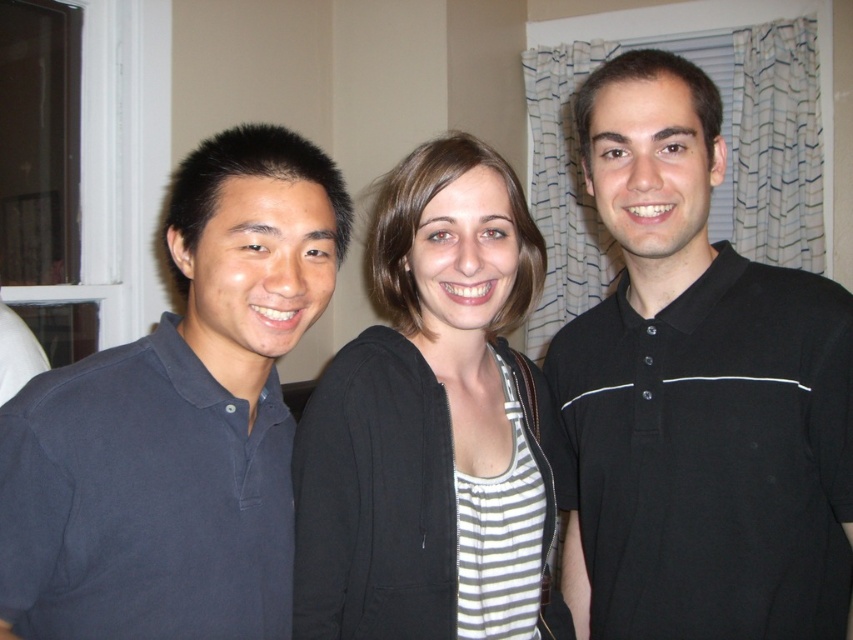
Question: Does black matte shirt at center appear over black zip-up hoodie at center?

Choices:
 (A) yes
 (B) no

Answer: (A)

Question: Which point appears closest to the camera in this image?

Choices:
 (A) (227, 349)
 (B) (759, 275)
 (C) (339, 403)

Answer: (A)

Question: Estimate the real-world distances between objects in this image. Which object is farther from the black zip-up hoodie at center?

Choices:
 (A) dark blue polo shirt at left
 (B) black matte shirt at center

Answer: (B)

Question: Can you confirm if black matte shirt at center is bigger than dark blue polo shirt at left?

Choices:
 (A) no
 (B) yes

Answer: (B)

Question: Does black matte shirt at center lie behind black zip-up hoodie at center?

Choices:
 (A) yes
 (B) no

Answer: (A)

Question: Which object is positioned closest to the dark blue polo shirt at left?

Choices:
 (A) black matte shirt at center
 (B) black zip-up hoodie at center

Answer: (B)